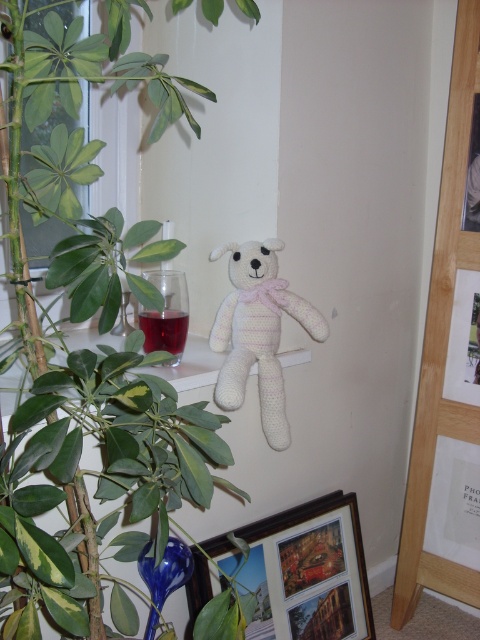
Question: Does green leafy plant at upper left lie behind wooden framed photo at lower center?

Choices:
 (A) no
 (B) yes

Answer: (A)

Question: Based on their relative distances, which object is nearer to the green leafy plant at upper left?

Choices:
 (A) wooden framed photo at lower center
 (B) white knitted bear at center

Answer: (B)

Question: Which object is positioned closest to the green leafy plant at upper left?

Choices:
 (A) wooden framed photo at lower center
 (B) white knitted bear at center

Answer: (B)

Question: Which point is farther to the camera?

Choices:
 (A) green leafy plant at upper left
 (B) white knitted bear at center
 (C) wooden framed photo at lower center

Answer: (C)

Question: Can you confirm if wooden framed photo at lower center is positioned below white knitted bear at center?

Choices:
 (A) yes
 (B) no

Answer: (A)

Question: Is wooden framed photo at lower center to the left of white knitted bear at center from the viewer's perspective?

Choices:
 (A) yes
 (B) no

Answer: (B)